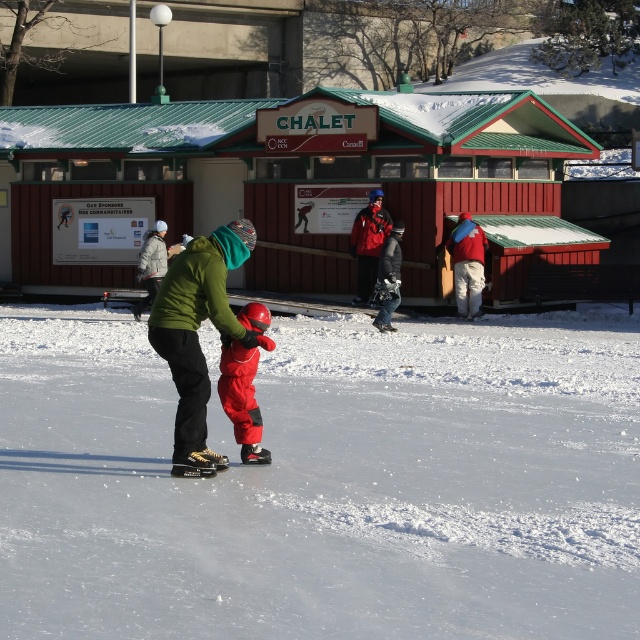
Consider the image. You are a photographer trying to capture a clear photo of the child in the matte red snowsuit at center and the adult in the red matte jacket at center. Which one will be in focus if you focus on the background?

The red matte jacket at center will be in focus because it is closer to the background than the matte red snowsuit at center.

Based on the photo, you are standing at the edge of the ice rink and want to walk towards the matte black snowsuit at center. However, there is a matte blue jacket at right in your path. Which object will you encounter first?

You will encounter the matte blue jacket at right first because it is closer to you than the matte black snowsuit at center.

You are organizing a winter event and need to ensure proper sizing for the participants. Given the two red garments present in the scene, the matte red snowsuit at center and the red matte jacket at center, which one is more suitable for a child participant?

The matte red snowsuit at center has a smaller size compared to the red matte jacket at center, making it more suitable for a child participant.